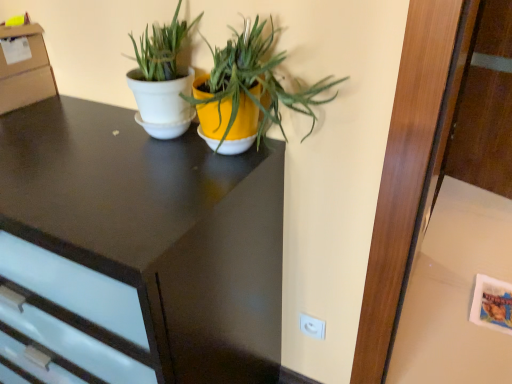
This screenshot has height=384, width=512. What do you see at coordinates (251, 87) in the screenshot?
I see `white glossy pot at center, the first houseplant from the right` at bounding box center [251, 87].

This screenshot has height=384, width=512. Identify the location of white plastic electric outlet at lower right. (312, 326).

Where is `white glossy pot at center, marked as the second houseplant in a right-to-left arrangement`? The width and height of the screenshot is (512, 384). white glossy pot at center, marked as the second houseplant in a right-to-left arrangement is located at coordinates (162, 80).

This screenshot has width=512, height=384. Identify the location of white glossy pot at center, which is the second houseplant in left-to-right order. (251, 87).

Which object is closer to the camera taking this photo, white glossy pot at center, the first houseplant from the right, or white plastic electric outlet at lower right?

white glossy pot at center, the first houseplant from the right.

Considering the relative sizes of white glossy pot at center, the first houseplant from the right, and white plastic electric outlet at lower right in the image provided, is white glossy pot at center, the first houseplant from the right, smaller than white plastic electric outlet at lower right?

Actually, white glossy pot at center, the first houseplant from the right, might be larger than white plastic electric outlet at lower right.

Choose the correct answer: Is white glossy pot at center, the first houseplant from the right, inside white plastic electric outlet at lower right or outside it?

white glossy pot at center, the first houseplant from the right, is located beyond the bounds of white plastic electric outlet at lower right.

From the image's perspective, is white glossy pot at center, which is the second houseplant in left-to-right order, located above or below white plastic electric outlet at lower right?

white glossy pot at center, which is the second houseplant in left-to-right order, is above white plastic electric outlet at lower right.

Would you consider matte black desk at center to be distant from white plastic electric outlet at lower right?

They are positioned close to each other.

Considering the relative sizes of matte black desk at center and white plastic electric outlet at lower right in the image provided, is matte black desk at center bigger than white plastic electric outlet at lower right?

Yes.

Is matte black desk at center taller than white plastic electric outlet at lower right?

Yes, matte black desk at center is taller than white plastic electric outlet at lower right.

From a real-world perspective, who is located lower, matte black desk at center or white plastic electric outlet at lower right?

In real-world perspective, white plastic electric outlet at lower right is lower.

Based on the photo, from a real-world perspective, is white glossy pot at center, which is the second houseplant in left-to-right order, located beneath white glossy pot at center, marked as the second houseplant in a right-to-left arrangement?

No, from a real-world perspective, white glossy pot at center, which is the second houseplant in left-to-right order, is not below white glossy pot at center, marked as the second houseplant in a right-to-left arrangement.

Is white glossy pot at center, which is the second houseplant in left-to-right order, positioned with its back to white glossy pot at center, which is the 1th houseplant from left to right?

No, white glossy pot at center, which is the 1th houseplant from left to right, is not at the back of white glossy pot at center, which is the second houseplant in left-to-right order.

From the image's perspective, which one is positioned higher, white glossy pot at center, which is the second houseplant in left-to-right order, or white glossy pot at center, marked as the second houseplant in a right-to-left arrangement?

white glossy pot at center, marked as the second houseplant in a right-to-left arrangement, is shown above in the image.

Is point (140, 62) closer or farther from the camera than point (507, 201)?

Clearly, point (140, 62) is closer to the camera than point (507, 201).

At what (x,y) coordinates should I click in order to perform the action: click on the 1st houseplant in front of the white glossy table at lower right. Please return your answer as a coordinate pair (x, y). Looking at the image, I should click on (162, 80).

Considering the positions of objects white glossy pot at center, marked as the second houseplant in a right-to-left arrangement, and white glossy table at lower right in the image provided, who is behind, white glossy pot at center, marked as the second houseplant in a right-to-left arrangement, or white glossy table at lower right?

white glossy table at lower right.

From a real-world perspective, does white glossy pot at center, marked as the second houseplant in a right-to-left arrangement, stand above white glossy table at lower right?

Yes, from a real-world perspective, white glossy pot at center, marked as the second houseplant in a right-to-left arrangement, is over white glossy table at lower right

Is white glossy table at lower right bigger than matte black desk at center?

No.

Does white glossy table at lower right appear on the left side of matte black desk at center?

No, white glossy table at lower right is not to the left of matte black desk at center.

In the scene shown: How different are the orientations of white glossy table at lower right and matte black desk at center in degrees?

The angle between the facing direction of white glossy table at lower right and the facing direction of matte black desk at center is 90.7 degrees.

Looking at their sizes, would you say white glossy table at lower right is wider or thinner than matte black desk at center?

Considering their sizes, white glossy table at lower right looks slimmer than matte black desk at center.

Is white plastic electric outlet at lower right situated inside white glossy pot at center, which is the second houseplant in left-to-right order, or outside?

white plastic electric outlet at lower right is outside white glossy pot at center, which is the second houseplant in left-to-right order.

Can you confirm if white plastic electric outlet at lower right is positioned to the right of white glossy pot at center, which is the second houseplant in left-to-right order?

Yes.

From the white plastic electric outlet at lower right, count 2nd houseplants forward and point to it. Please provide its 2D coordinates.

[(251, 87)]

From a real-world perspective, relative to white glossy pot at center, which is the second houseplant in left-to-right order, is white plastic electric outlet at lower right vertically above or below?

From a real-world perspective, white plastic electric outlet at lower right is physically below white glossy pot at center, which is the second houseplant in left-to-right order.

In the scene shown: Can you confirm if white glossy table at lower right is wider than white glossy pot at center, which is the 1th houseplant from left to right?

Yes.

From the image's perspective, is white glossy table at lower right located above white glossy pot at center, marked as the second houseplant in a right-to-left arrangement?

Incorrect, from the image's perspective, white glossy table at lower right is lower than white glossy pot at center, marked as the second houseplant in a right-to-left arrangement.

Is point (499, 255) closer or farther from the camera than point (161, 88)?

Point (499, 255) appears to be farther away from the viewer than point (161, 88).

Locate an element on the screen. This screenshot has width=512, height=384. the 1st houseplant in front when counting from the white glossy table at lower right is located at coordinates (162, 80).

From the image's perspective, which houseplant is the 1st one above the white plastic electric outlet at lower right? Please provide its 2D coordinates.

[(251, 87)]

Where is `electric outlet on the right of matte black desk at center`? This screenshot has width=512, height=384. electric outlet on the right of matte black desk at center is located at coordinates (312, 326).

When comparing their distances from matte black desk at center, does white plastic electric outlet at lower right or white glossy table at lower right seem closer?

white plastic electric outlet at lower right.

Considering their positions, is white glossy table at lower right positioned further to white glossy pot at center, marked as the second houseplant in a right-to-left arrangement, than matte black desk at center?

white glossy table at lower right is positioned further to the anchor white glossy pot at center, marked as the second houseplant in a right-to-left arrangement.

Based on the photo, estimate the real-world distances between objects in this image. Which object is closer to white glossy table at lower right, matte black desk at center or white glossy pot at center, marked as the second houseplant in a right-to-left arrangement?

matte black desk at center is closer to white glossy table at lower right.

Considering their positions, is white glossy pot at center, marked as the second houseplant in a right-to-left arrangement, positioned closer to white plastic electric outlet at lower right than white glossy pot at center, the first houseplant from the right?

The object closer to white plastic electric outlet at lower right is white glossy pot at center, the first houseplant from the right.

Looking at the image, which one is located closer to white glossy table at lower right, white plastic electric outlet at lower right or white glossy pot at center, marked as the second houseplant in a right-to-left arrangement?

white plastic electric outlet at lower right lies closer to white glossy table at lower right than the other object.

Which object lies further to the anchor point white glossy pot at center, which is the second houseplant in left-to-right order, matte black desk at center or white plastic electric outlet at lower right?

white plastic electric outlet at lower right.

Considering their positions, is white glossy table at lower right positioned further to white plastic electric outlet at lower right than matte black desk at center?

white glossy table at lower right is positioned further to the anchor white plastic electric outlet at lower right.

Which object lies nearer to the anchor point white glossy pot at center, marked as the second houseplant in a right-to-left arrangement, white glossy table at lower right or white plastic electric outlet at lower right?

The object closer to white glossy pot at center, marked as the second houseplant in a right-to-left arrangement, is white plastic electric outlet at lower right.

Where is `electric outlet situated between white glossy pot at center, marked as the second houseplant in a right-to-left arrangement, and white glossy table at lower right from left to right`? This screenshot has width=512, height=384. electric outlet situated between white glossy pot at center, marked as the second houseplant in a right-to-left arrangement, and white glossy table at lower right from left to right is located at coordinates (312, 326).

Where is `houseplant between white glossy pot at center, which is the 1th houseplant from left to right, and white plastic electric outlet at lower right in the up-down direction`? Image resolution: width=512 pixels, height=384 pixels. houseplant between white glossy pot at center, which is the 1th houseplant from left to right, and white plastic electric outlet at lower right in the up-down direction is located at coordinates click(x=251, y=87).

Identify the location of houseplant located between matte black desk at center and white glossy pot at center, which is the second houseplant in left-to-right order, in the left-right direction. The height and width of the screenshot is (384, 512). (162, 80).

The width and height of the screenshot is (512, 384). I want to click on electric outlet situated between matte black desk at center and white glossy table at lower right from left to right, so click(x=312, y=326).